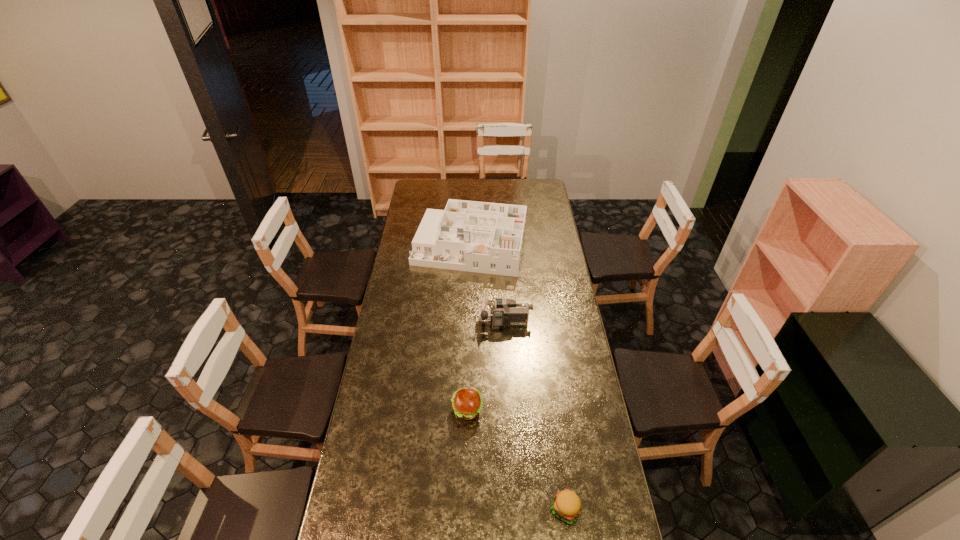
Identify the location of vacant area located on the right of the second nearest object. The image size is (960, 540). (582, 410).

Find the location of a particular element. vacant space located 0.310m on the left of the right hamburger is located at coordinates (454, 509).

The width and height of the screenshot is (960, 540). Find the location of `object present at the left edge`. object present at the left edge is located at coordinates (483, 237).

Where is `object present at the right edge`? The height and width of the screenshot is (540, 960). object present at the right edge is located at coordinates (566, 505).

In the image, there is a desktop. Find the location of `vacant space at the far edge`. vacant space at the far edge is located at coordinates (465, 185).

In the image, there is a desktop. What are the coordinates of `blank space at the left edge` in the screenshot? It's located at (413, 323).

Image resolution: width=960 pixels, height=540 pixels. I want to click on vacant area at the right edge, so click(556, 380).

Identify the location of vacant space at the far right corner of the desktop. (529, 185).

Where is `free space between the dollhouse and the camcorder`? This screenshot has height=540, width=960. free space between the dollhouse and the camcorder is located at coordinates (488, 285).

In order to click on vacant space that is in between the second farthest object and the farther hamburger in this screenshot , I will do `click(486, 366)`.